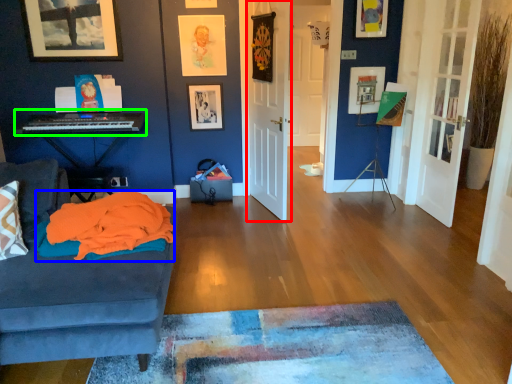
Question: Considering the real-world distances, which object is farthest from door (highlighted by a red box)? blanket (highlighted by a blue box) or musical keyboard (highlighted by a green box)?

Choices:
 (A) blanket
 (B) musical keyboard

Answer: (A)